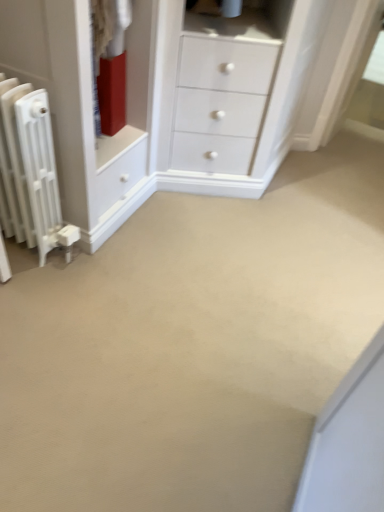
What do you see at coordinates (31, 170) in the screenshot? I see `white matte radiator at left` at bounding box center [31, 170].

The image size is (384, 512). I want to click on white matte radiator at left, so click(31, 170).

The height and width of the screenshot is (512, 384). Describe the element at coordinates (83, 109) in the screenshot. I see `matte white chest of drawers at left` at that location.

I want to click on matte white chest of drawers at left, so click(x=83, y=109).

What is the approximate width of matte white chest of drawers at left?

matte white chest of drawers at left is 12.53 inches in width.

Find the location of `white matte radiator at left`. white matte radiator at left is located at coordinates (31, 170).

From the picture: Which object is positioned more to the right, white matte radiator at left or matte white chest of drawers at left?

matte white chest of drawers at left.

Which is behind, white matte radiator at left or matte white chest of drawers at left?

matte white chest of drawers at left is further away from the camera.

Does point (23, 172) lie behind point (104, 224)?

No, (23, 172) is in front of (104, 224).

From the image's perspective, relative to matte white chest of drawers at left, is white matte radiator at left above or below?

white matte radiator at left is situated lower than matte white chest of drawers at left in the image.

From a real-world perspective, is white matte radiator at left positioned over matte white chest of drawers at left based on gravity?

Actually, white matte radiator at left is physically below matte white chest of drawers at left in the real world.

Considering the sizes of white matte radiator at left and matte white chest of drawers at left in the image, is white matte radiator at left wider or thinner than matte white chest of drawers at left?

Clearly, white matte radiator at left has more width compared to matte white chest of drawers at left.

Considering the relative sizes of white matte radiator at left and matte white chest of drawers at left in the image provided, is white matte radiator at left taller than matte white chest of drawers at left?

Correct, white matte radiator at left is much taller as matte white chest of drawers at left.

Between white matte radiator at left and matte white chest of drawers at left, which one has larger size?

Bigger between the two is matte white chest of drawers at left.

Is white matte radiator at left inside or outside of matte white chest of drawers at left?

white matte radiator at left is spatially situated outside matte white chest of drawers at left.

In the scene shown: Is white matte radiator at left next to matte white chest of drawers at left and touching it?

white matte radiator at left and matte white chest of drawers at left are not in contact.

Is white matte radiator at left facing away from matte white chest of drawers at left?

white matte radiator at left does not have its back to matte white chest of drawers at left.

How far apart are white matte radiator at left and matte white chest of drawers at left?

white matte radiator at left is 8.23 inches away from matte white chest of drawers at left.

I want to click on radiator below the matte white chest of drawers at left (from the image's perspective), so click(x=31, y=170).

Is matte white chest of drawers at left at the right side of white matte radiator at left?

Correct, you'll find matte white chest of drawers at left to the right of white matte radiator at left.

In the image, is matte white chest of drawers at left positioned in front of or behind white matte radiator at left?

matte white chest of drawers at left is behind white matte radiator at left.

Considering the points (125, 146) and (29, 193), which point is in front, point (125, 146) or point (29, 193)?

The point (29, 193) is closer to the camera.

From the image's perspective, between matte white chest of drawers at left and white matte radiator at left, which one is located above?

matte white chest of drawers at left.

From a real-world perspective, between matte white chest of drawers at left and white matte radiator at left, who is vertically higher?

From a 3D spatial view, matte white chest of drawers at left is above.

Considering the sizes of matte white chest of drawers at left and white matte radiator at left in the image, is matte white chest of drawers at left wider or thinner than white matte radiator at left?

matte white chest of drawers at left is thinner than white matte radiator at left.

Considering the sizes of matte white chest of drawers at left and white matte radiator at left in the image, is matte white chest of drawers at left taller or shorter than white matte radiator at left?

Considering their sizes, matte white chest of drawers at left has less height than white matte radiator at left.

Considering the relative sizes of matte white chest of drawers at left and white matte radiator at left in the image provided, is matte white chest of drawers at left smaller than white matte radiator at left?

Actually, matte white chest of drawers at left might be larger than white matte radiator at left.

Is matte white chest of drawers at left positioned beyond the bounds of white matte radiator at left?

matte white chest of drawers at left lies outside white matte radiator at left's area.

Is matte white chest of drawers at left beside white matte radiator at left?

No, matte white chest of drawers at left is not next to white matte radiator at left.

Is matte white chest of drawers at left positioned with its back to white matte radiator at left?

No, white matte radiator at left is not at the back of matte white chest of drawers at left.

What's the angular difference between matte white chest of drawers at left and white matte radiator at left's facing directions?

There is a 3.83-degree angle between the facing directions of matte white chest of drawers at left and white matte radiator at left.

The height and width of the screenshot is (512, 384). Identify the location of the chest of drawers behind the white matte radiator at left. (83, 109).

I want to click on radiator in front of the matte white chest of drawers at left, so click(x=31, y=170).

Where is `chest of drawers located on the right of white matte radiator at left`? Image resolution: width=384 pixels, height=512 pixels. chest of drawers located on the right of white matte radiator at left is located at coordinates (83, 109).